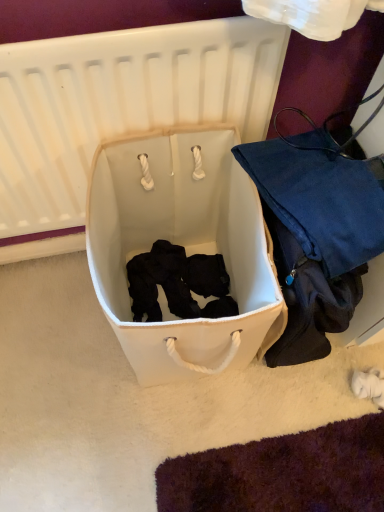
Question: Does white fabric infant bed at center have a greater height compared to matte blue fabric bag at right?

Choices:
 (A) no
 (B) yes

Answer: (B)

Question: Is white fabric infant bed at center positioned before matte blue fabric bag at right?

Choices:
 (A) no
 (B) yes

Answer: (B)

Question: From a real-world perspective, does white fabric infant bed at center sit lower than matte blue fabric bag at right?

Choices:
 (A) yes
 (B) no

Answer: (B)

Question: Is white fabric infant bed at center at the right side of matte blue fabric bag at right?

Choices:
 (A) yes
 (B) no

Answer: (B)

Question: Are white fabric infant bed at center and matte blue fabric bag at right far apart?

Choices:
 (A) no
 (B) yes

Answer: (A)

Question: Considering the relative sizes of white fabric infant bed at center and matte blue fabric bag at right in the image provided, is white fabric infant bed at center thinner than matte blue fabric bag at right?

Choices:
 (A) yes
 (B) no

Answer: (A)

Question: Can you confirm if matte blue fabric bag at right is bigger than white fabric laundry basket at center?

Choices:
 (A) yes
 (B) no

Answer: (B)

Question: Can you confirm if matte blue fabric bag at right is smaller than white fabric laundry basket at center?

Choices:
 (A) no
 (B) yes

Answer: (B)

Question: Is matte blue fabric bag at right outside white fabric laundry basket at center?

Choices:
 (A) yes
 (B) no

Answer: (A)

Question: From the image's perspective, is matte blue fabric bag at right above white fabric laundry basket at center?

Choices:
 (A) no
 (B) yes

Answer: (B)

Question: Is matte blue fabric bag at right positioned with its back to white fabric laundry basket at center?

Choices:
 (A) yes
 (B) no

Answer: (B)

Question: Is matte blue fabric bag at right closer to camera compared to white fabric laundry basket at center?

Choices:
 (A) no
 (B) yes

Answer: (B)

Question: Would you say white fabric infant bed at center is part of white fabric laundry basket at center's contents?

Choices:
 (A) yes
 (B) no

Answer: (B)